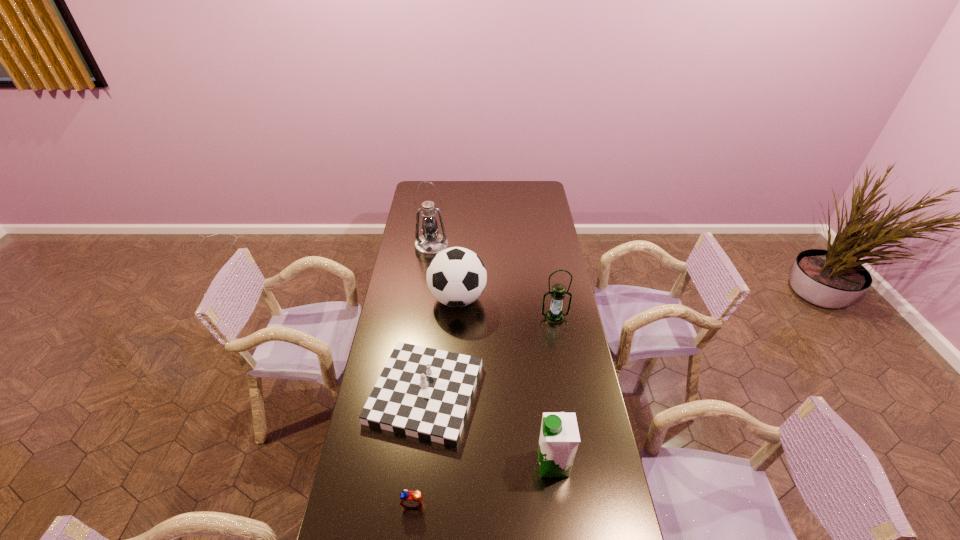
Locate an element on the screen. The width and height of the screenshot is (960, 540). soya milk that is at the right edge is located at coordinates (559, 437).

Image resolution: width=960 pixels, height=540 pixels. Identify the location of vacant space at the far edge of the desktop. (481, 197).

The image size is (960, 540). In the image, there is a desktop. What are the coordinates of `blank space at the left edge` in the screenshot? It's located at (404, 317).

I want to click on vacant space at the right edge of the desktop, so click(577, 411).

You are a GUI agent. You are given a task and a screenshot of the screen. Output one action in this format:
    pyautogui.click(x=<x>, y=<y>)
    Task: Click on the unoccupied area between the lantern and the soccer ball
    Image resolution: width=960 pixels, height=540 pixels.
    Given the screenshot: What is the action you would take?
    pyautogui.click(x=506, y=308)

The height and width of the screenshot is (540, 960). In order to click on unoccupied position between the soccer ball and the lantern in this screenshot , I will do `click(506, 308)`.

Locate an element on the screen. The height and width of the screenshot is (540, 960). vacant area that lies between the soya milk and the lantern is located at coordinates (554, 391).

Identify the location of vacant point located between the lantern and the shortest object. point(484,410).

Find the location of a particular element. The height and width of the screenshot is (540, 960). object that is the fourth closest to the farthest object is located at coordinates 559,437.

Identify which object is the fourth closest to the fifth tallest object. Please provide its 2D coordinates. Your answer should be formatted as a tuple, i.e. [(x, y)], where the tuple contains the x and y coordinates of a point satisfying the conditions above.

[(554, 316)]